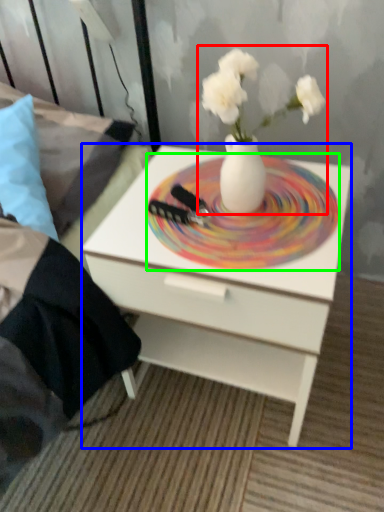
Question: Estimate the real-world distances between objects in this image. Which object is closer to floral arrangement (highlighted by a red box), nightstand (highlighted by a blue box) or plate (highlighted by a green box)?

Choices:
 (A) nightstand
 (B) plate

Answer: (B)